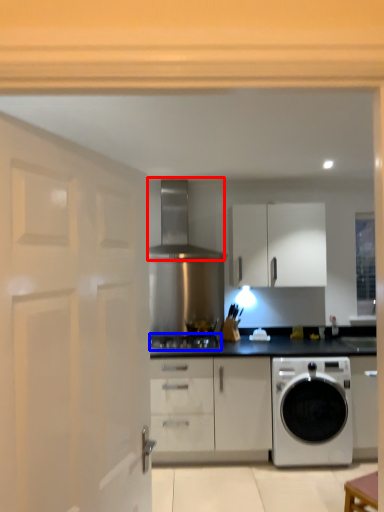
Question: Which object appears farthest to the camera in this image, exhaust hood (highlighted by a red box) or gas stove (highlighted by a blue box)?

Choices:
 (A) exhaust hood
 (B) gas stove

Answer: (A)